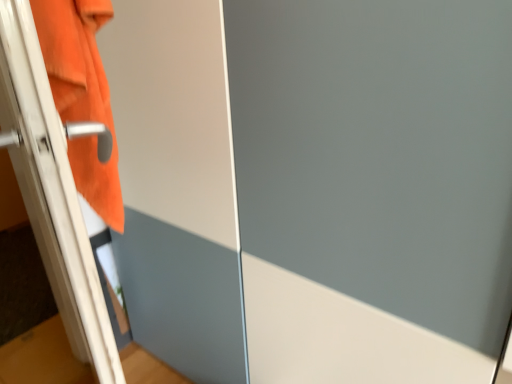
Question: Should I look upward or downward to see white glossy screen door at left?

Choices:
 (A) up
 (B) down

Answer: (B)

Question: From the image's perspective, is white glossy screen door at left located above orange fabric towel at left?

Choices:
 (A) no
 (B) yes

Answer: (A)

Question: From a real-world perspective, is white glossy screen door at left positioned under orange fabric towel at left based on gravity?

Choices:
 (A) yes
 (B) no

Answer: (A)

Question: Can we say white glossy screen door at left lies outside orange fabric towel at left?

Choices:
 (A) no
 (B) yes

Answer: (B)

Question: Does white glossy screen door at left have a lesser width compared to orange fabric towel at left?

Choices:
 (A) no
 (B) yes

Answer: (A)

Question: Is white glossy screen door at left facing towards orange fabric towel at left?

Choices:
 (A) yes
 (B) no

Answer: (A)

Question: Does white glossy screen door at left have a greater height compared to orange fabric towel at left?

Choices:
 (A) yes
 (B) no

Answer: (A)

Question: Are orange fabric towel at left and white glossy screen door at left far apart?

Choices:
 (A) yes
 (B) no

Answer: (B)

Question: From a real-world perspective, is orange fabric towel at left positioned under white glossy screen door at left based on gravity?

Choices:
 (A) yes
 (B) no

Answer: (B)

Question: Does orange fabric towel at left come behind white glossy screen door at left?

Choices:
 (A) yes
 (B) no

Answer: (A)

Question: Is orange fabric towel at left at the left side of white glossy screen door at left?

Choices:
 (A) yes
 (B) no

Answer: (B)

Question: Is white glossy screen door at left a part of orange fabric towel at left?

Choices:
 (A) yes
 (B) no

Answer: (B)

Question: Can you confirm if orange fabric towel at left is smaller than white glossy screen door at left?

Choices:
 (A) yes
 (B) no

Answer: (A)

Question: In terms of size, does orange fabric towel at left appear bigger or smaller than white glossy screen door at left?

Choices:
 (A) big
 (B) small

Answer: (B)